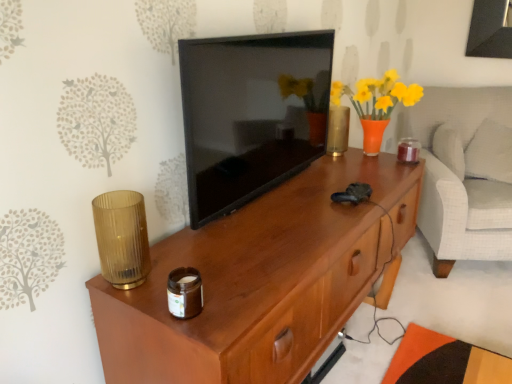
I want to click on vacant point to the right of brown glass jar at lower center, the second candle holder when ordered from left to right, so click(x=242, y=298).